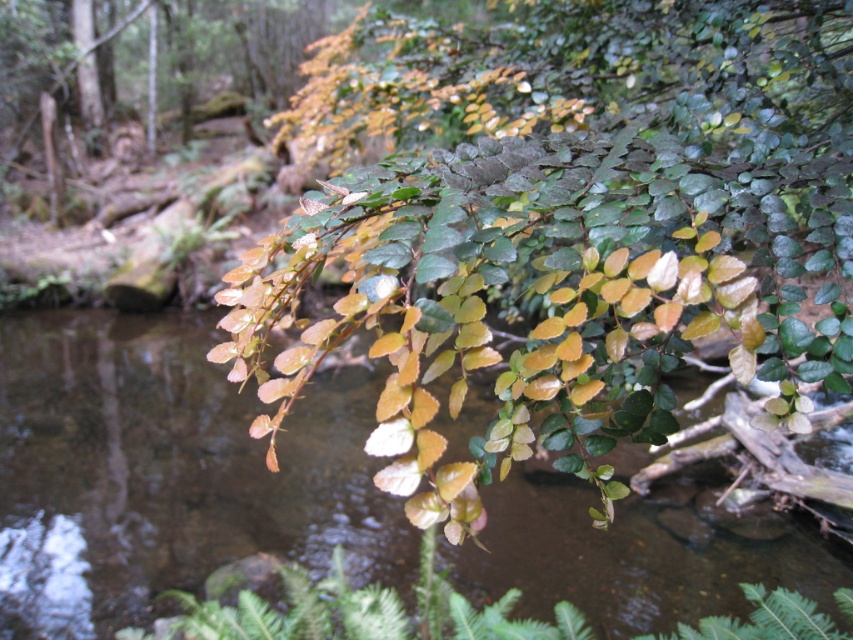
Between green glossy leaves at upper center and green leafy branch at center, which one appears on the left side from the viewer's perspective?

green glossy leaves at upper center

Is green glossy leaves at upper center shorter than green leafy branch at center?

Incorrect, green glossy leaves at upper center's height does not fall short of green leafy branch at center's.

Which is in front, point (572, 180) or point (57, 314)?

Point (572, 180)

You are a GUI agent. You are given a task and a screenshot of the screen. Output one action in this format:
    pyautogui.click(x=<x>, y=<y>)
    Task: Click on the green glossy leaves at upper center
    
    Given the screenshot: What is the action you would take?
    pyautogui.click(x=569, y=228)